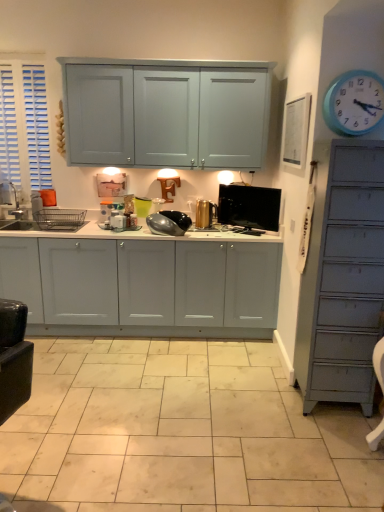
Question: Would you consider gold metallic canister at center, the 2th appliance in the left-to-right sequence, to be distant from white glossy cabinets at center?

Choices:
 (A) yes
 (B) no

Answer: (B)

Question: Is gold metallic canister at center, which ranks as the 2th appliance in right-to-left order, shorter than white glossy cabinets at center?

Choices:
 (A) yes
 (B) no

Answer: (A)

Question: Is gold metallic canister at center, the 2th appliance in the left-to-right sequence, surrounding white glossy cabinets at center?

Choices:
 (A) yes
 (B) no

Answer: (B)

Question: Does gold metallic canister at center, which ranks as the 2th appliance in right-to-left order, have a greater height compared to white glossy cabinets at center?

Choices:
 (A) no
 (B) yes

Answer: (A)

Question: Does gold metallic canister at center, the 2th appliance in the left-to-right sequence, lie in front of white glossy cabinets at center?

Choices:
 (A) yes
 (B) no

Answer: (B)

Question: From the image's perspective, is gold metallic canister at center, which ranks as the 2th appliance in right-to-left order, beneath white glossy cabinets at center?

Choices:
 (A) no
 (B) yes

Answer: (A)

Question: Is there a large distance between brushed metal sink at left and gold metallic canister at center, which ranks as the 2th appliance in right-to-left order?

Choices:
 (A) yes
 (B) no

Answer: (A)

Question: Is brushed metal sink at left positioned with its back to gold metallic canister at center, which ranks as the 2th appliance in right-to-left order?

Choices:
 (A) yes
 (B) no

Answer: (B)

Question: Could gold metallic canister at center, the 2th appliance in the left-to-right sequence, be considered to be inside brushed metal sink at left?

Choices:
 (A) yes
 (B) no

Answer: (B)

Question: From the image's perspective, is brushed metal sink at left above gold metallic canister at center, the 2th appliance in the left-to-right sequence?

Choices:
 (A) no
 (B) yes

Answer: (B)

Question: From a real-world perspective, is brushed metal sink at left physically below gold metallic canister at center, which ranks as the 2th appliance in right-to-left order?

Choices:
 (A) no
 (B) yes

Answer: (A)

Question: Considering the relative positions of brushed metal sink at left and gold metallic canister at center, the 2th appliance in the left-to-right sequence, in the image provided, is brushed metal sink at left to the left of gold metallic canister at center, the 2th appliance in the left-to-right sequence, from the viewer's perspective?

Choices:
 (A) no
 (B) yes

Answer: (B)

Question: Is white glossy tile at center closer to camera compared to white glossy cabinets at center?

Choices:
 (A) no
 (B) yes

Answer: (B)